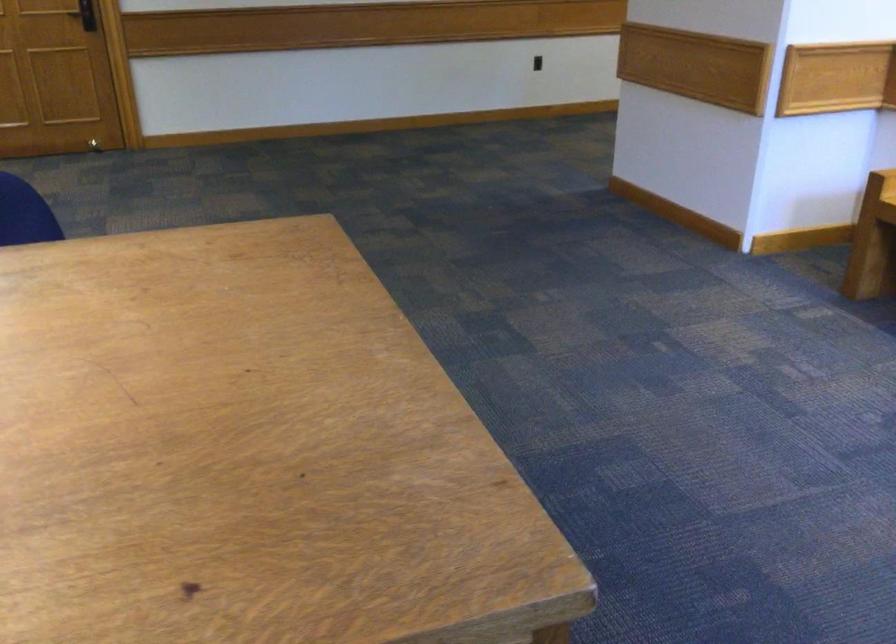
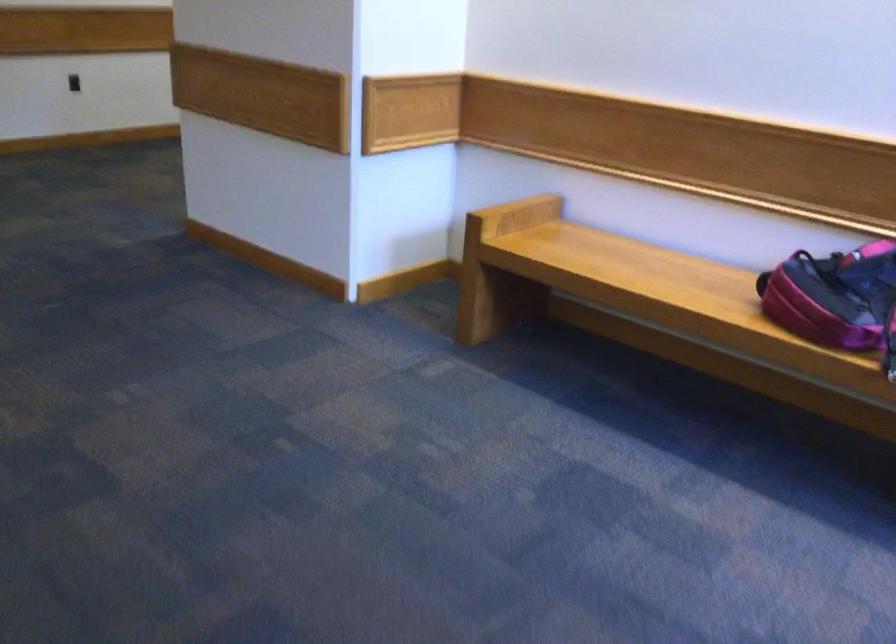
Question: Based on the continuous images, in which direction is the camera rotating? Reply with the corresponding letter.

Choices:
 (A) Left
 (B) Right
 (C) Up
 (D) Down

Answer: (B)